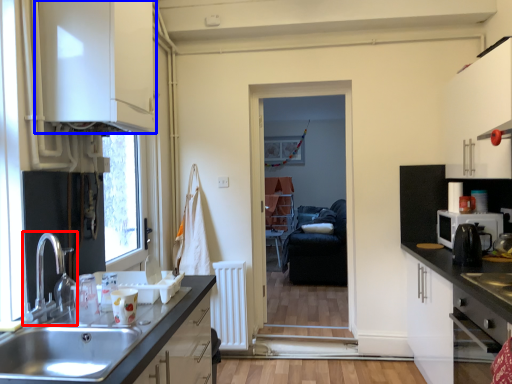
Question: Which object appears farthest to the camera in this image, tap (highlighted by a red box) or cabinetry (highlighted by a blue box)?

Choices:
 (A) tap
 (B) cabinetry

Answer: (B)